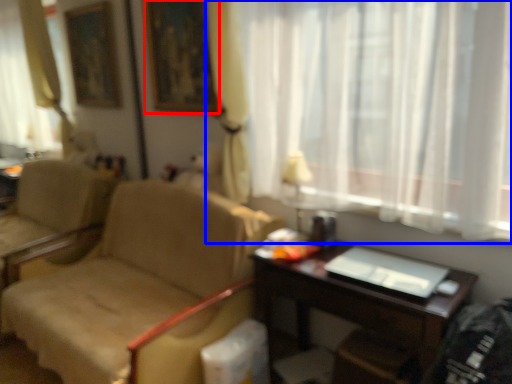
Question: Which object appears farthest to the camera in this image, picture frame (highlighted by a red box) or curtain (highlighted by a blue box)?

Choices:
 (A) picture frame
 (B) curtain

Answer: (A)